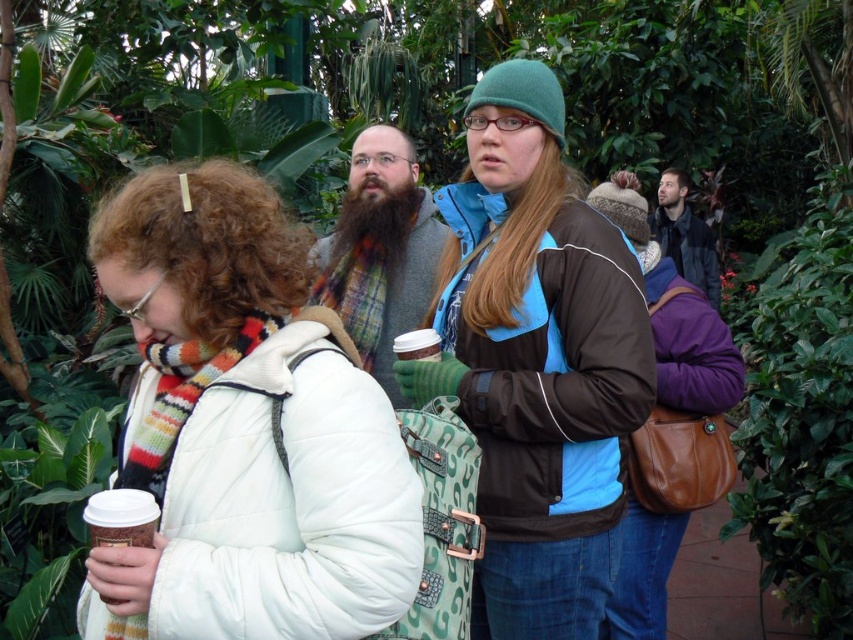
Question: Can you confirm if flannel scarf at center is positioned above white paper cup at center?

Choices:
 (A) no
 (B) yes

Answer: (B)

Question: Does brown/blue quilted jacket at center lie behind brown leather purse at center?

Choices:
 (A) no
 (B) yes

Answer: (A)

Question: Among these points, which one is farthest from the camera?

Choices:
 (A) (706, 253)
 (B) (422, 344)
 (C) (645, 314)

Answer: (A)

Question: Does white puffy jacket at center appear over leather jacket at upper right?

Choices:
 (A) yes
 (B) no

Answer: (B)

Question: Estimate the real-world distances between objects in this image. Which object is farther from the multicolored knitted scarf at left?

Choices:
 (A) white paper cup at center
 (B) brown leather purse at center
 (C) flannel scarf at center

Answer: (B)

Question: Considering the real-world distances, which object is closest to the brown leather purse at center?

Choices:
 (A) white puffy jacket at center
 (B) brown/blue quilted jacket at center

Answer: (B)